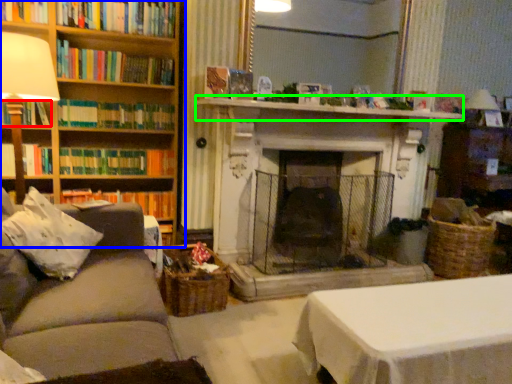
Question: Which object is positioned farthest from book (highlighted by a red box)? Select from bookcase (highlighted by a blue box) and mantle (highlighted by a green box).

Choices:
 (A) bookcase
 (B) mantle

Answer: (B)